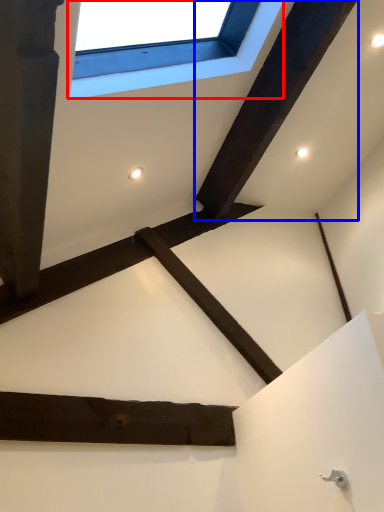
Question: Which object appears closest to the camera in this image, window (highlighted by a red box) or plank (highlighted by a blue box)?

Choices:
 (A) window
 (B) plank

Answer: (A)